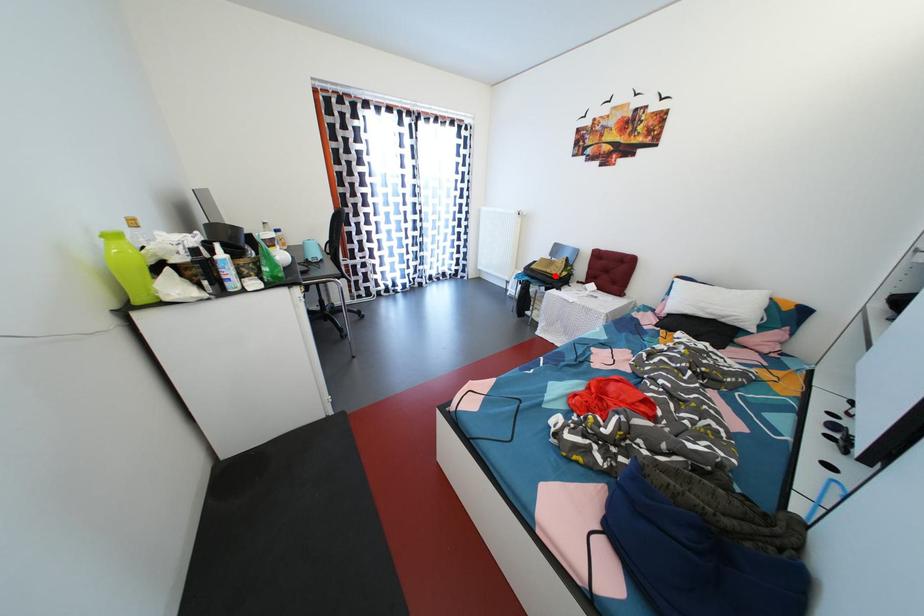
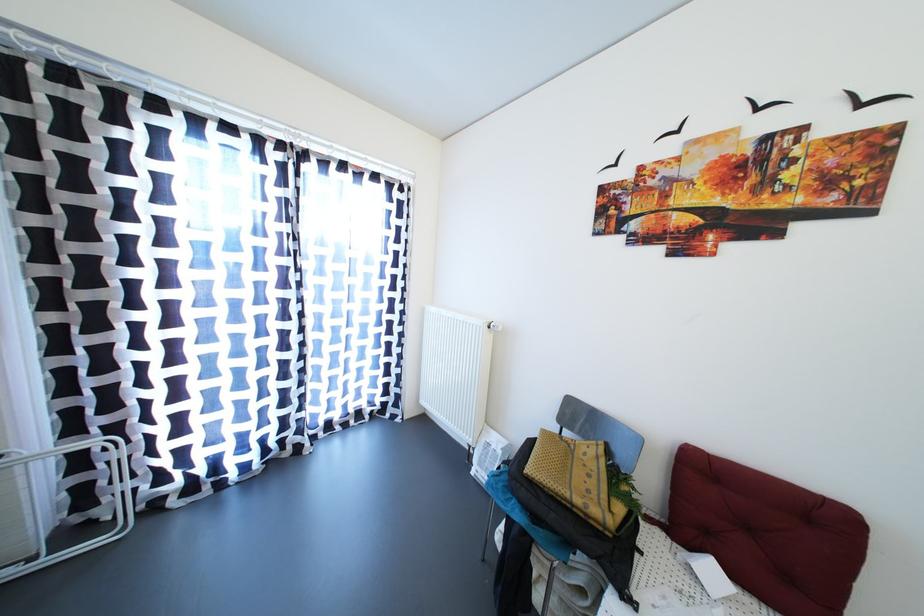
Question: I am providing you with two images of the same scene from different viewpoints. Given a red point in image1, look at the same physical point in image2. Is it:

Choices:
 (A) Closer to the viewpoint
 (B) Farther from the viewpoint

Answer: (B)